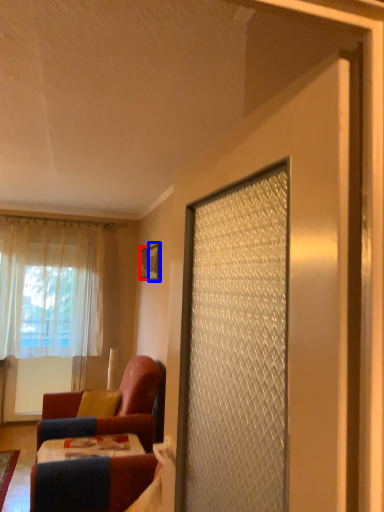
Question: Which of the following is the farthest to the observer, picture frame (highlighted by a red box) or picture frame (highlighted by a blue box)?

Choices:
 (A) picture frame
 (B) picture frame

Answer: (A)